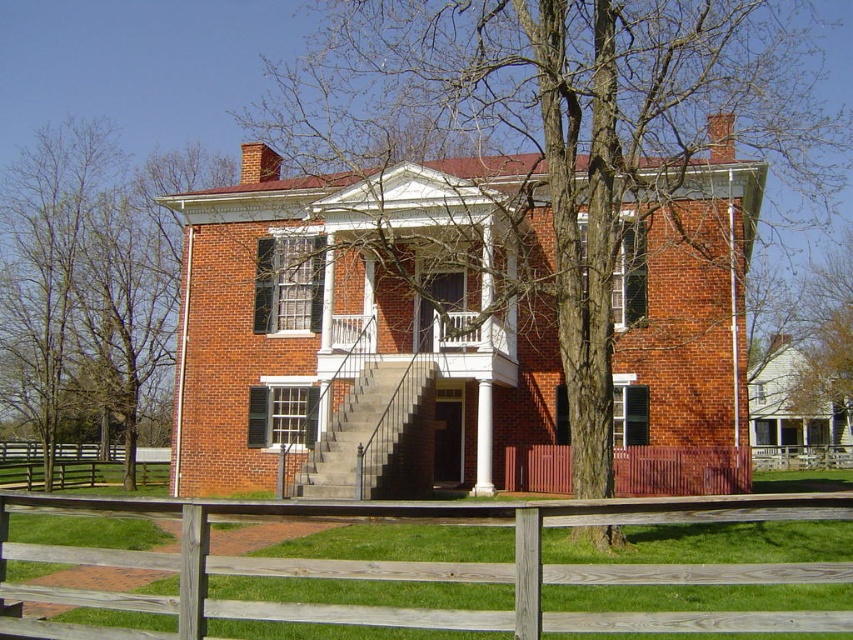
Question: Among these points, which one is nearest to the camera?

Choices:
 (A) (496, 28)
 (B) (103, 464)
 (C) (90, 346)

Answer: (A)

Question: Is wooden picket fence at lower center above white smooth column at center?

Choices:
 (A) yes
 (B) no

Answer: (A)

Question: Among these points, which one is nearest to the camera?

Choices:
 (A) (489, 406)
 (B) (827, 291)
 (C) (62, 461)

Answer: (A)

Question: Which point appears closest to the camera in this image?

Choices:
 (A) (126, 275)
 (B) (730, 465)
 (C) (3, 481)

Answer: (B)

Question: Does bare wood tree at center have a lesser width compared to rustic wooden fence at lower center?

Choices:
 (A) no
 (B) yes

Answer: (A)

Question: Is bare wood tree at right positioned behind rustic wooden fence at lower center?

Choices:
 (A) yes
 (B) no

Answer: (A)